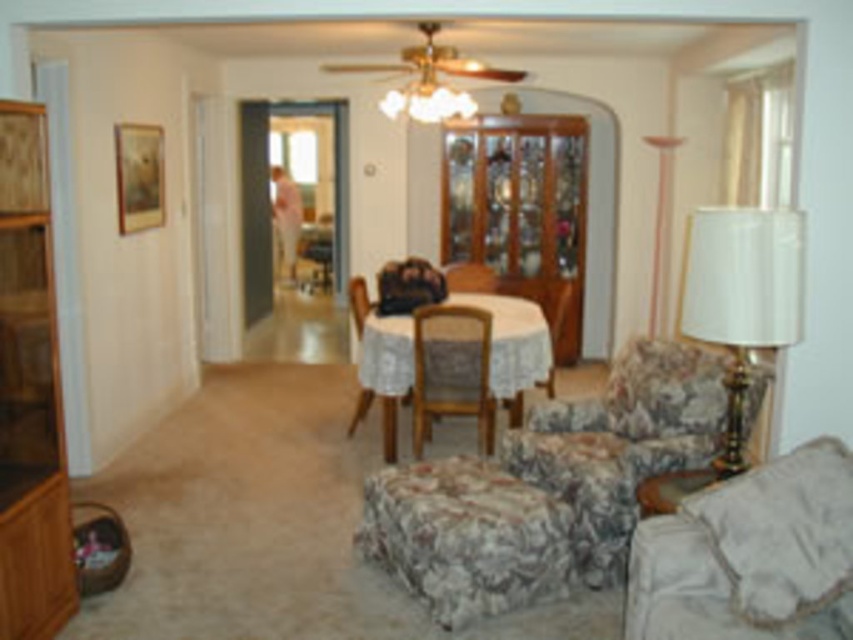
From the picture: You are arranging a dinner party and want to place a centerpiece on the white lace tablecloth at center. However, you notice the white fabric lampshade at right might block the view from the dining area. Is the lampshade in front of or behind the tablecloth?

The white fabric lampshade at right is in front of the white lace tablecloth at center, so it would block the view from the dining area.

You are standing in the living room and want to take a photo of the dining area. You notice two points marked in the image, point 1 at coordinates point (445,348) and point 2 at coordinates point (471,266). Which point is closer to your current position?

Point (445,348) is closer to the camera than point (471,266), so point 1 is closer to your current position.